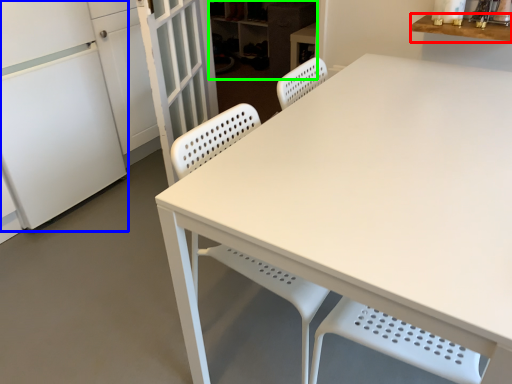
Question: Which is nearer to the counter top (highlighted by a red box)? fridge (highlighted by a blue box) or cabinetry (highlighted by a green box).

Choices:
 (A) fridge
 (B) cabinetry

Answer: (A)